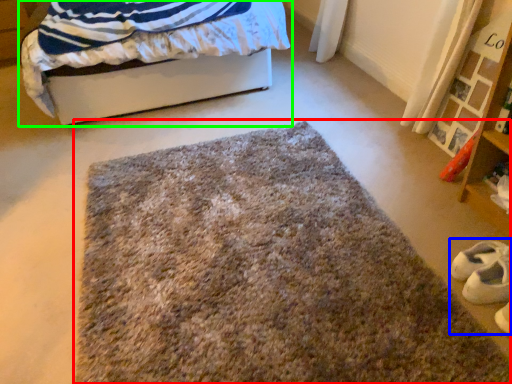
Question: Which object is positioned closest to mat (highlighted by a red box)? Select from shoe (highlighted by a blue box) and bed (highlighted by a green box).

Choices:
 (A) shoe
 (B) bed

Answer: (A)